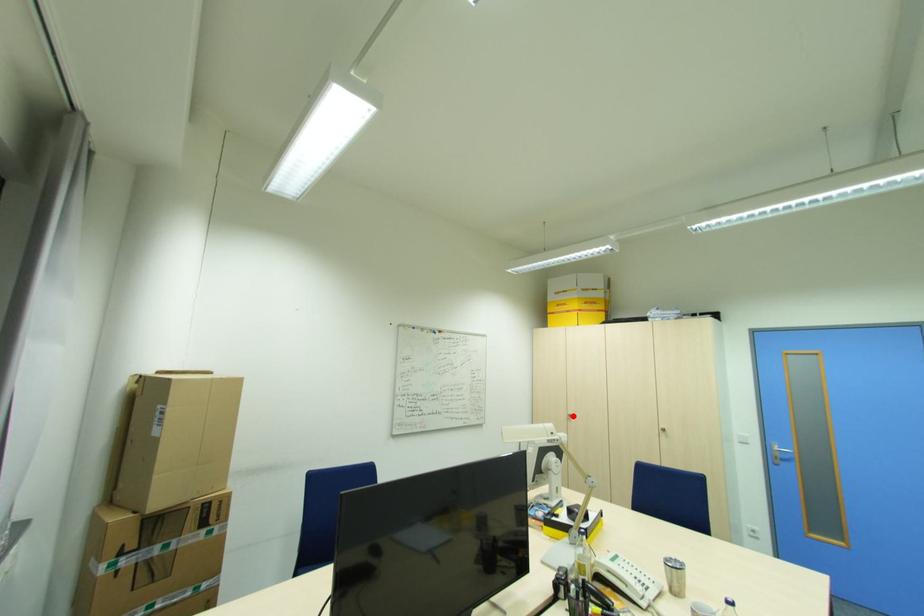
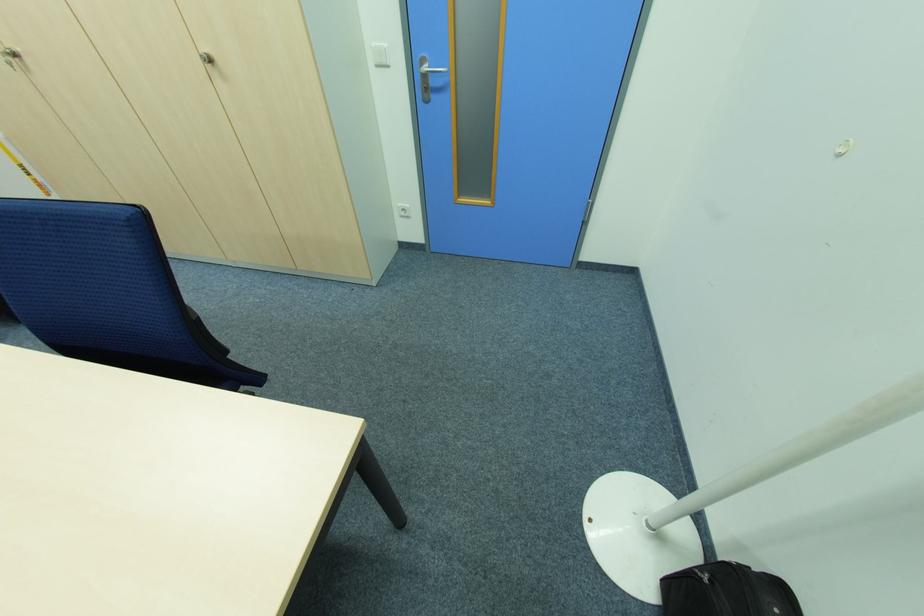
The point at the highlighted location is marked in the first image. Where is the corresponding point in the second image?

(18, 55)